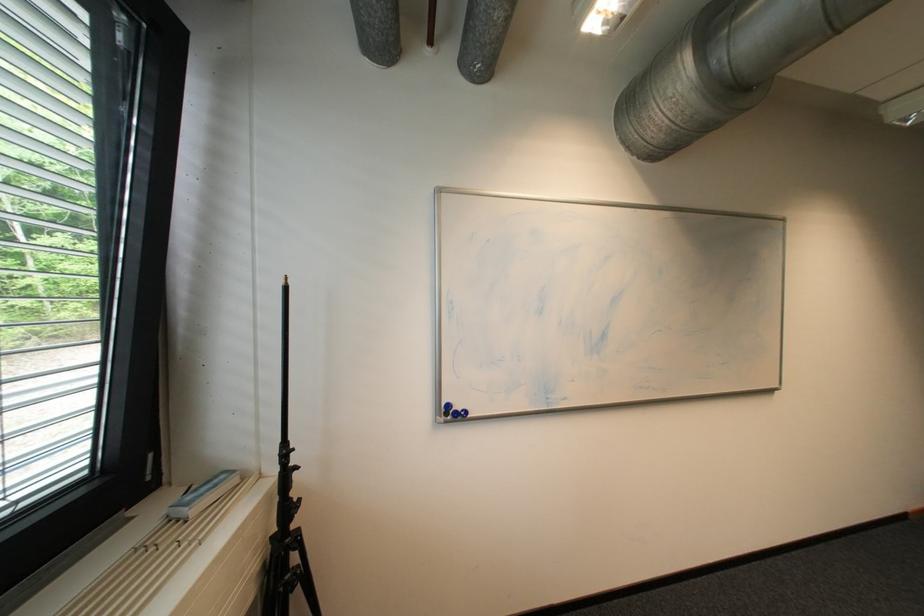
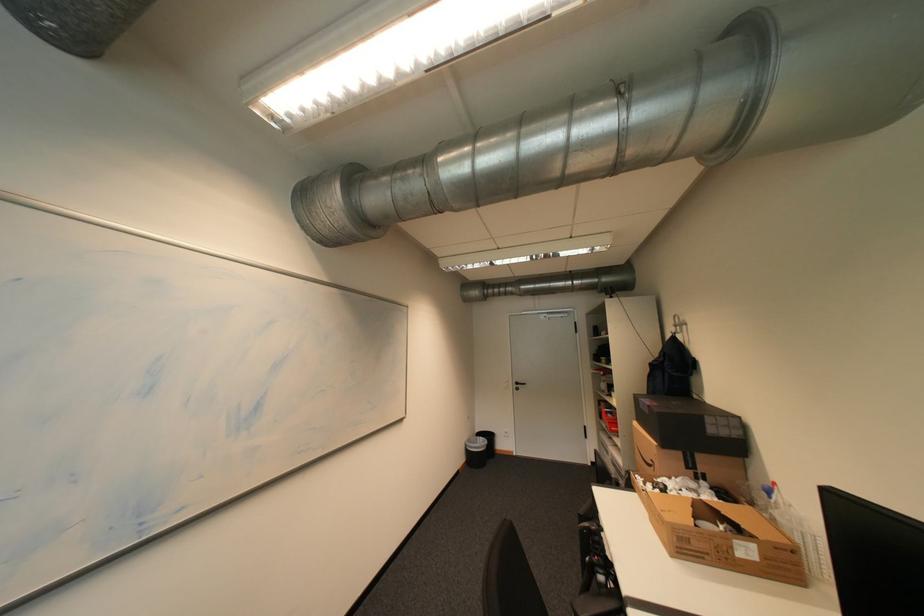
Question: How did the camera likely rotate?

Choices:
 (A) Left
 (B) Right
 (C) Up
 (D) Down

Answer: (B)